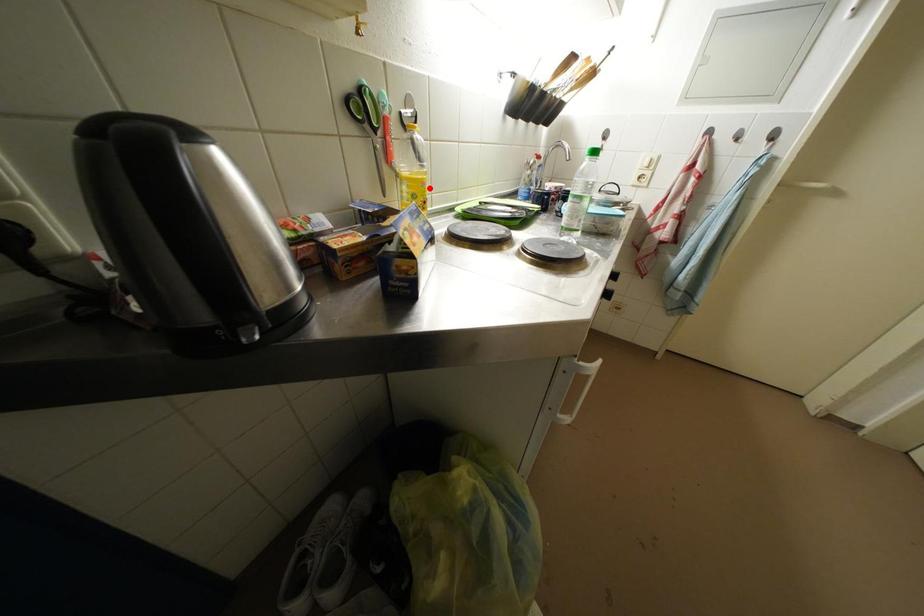
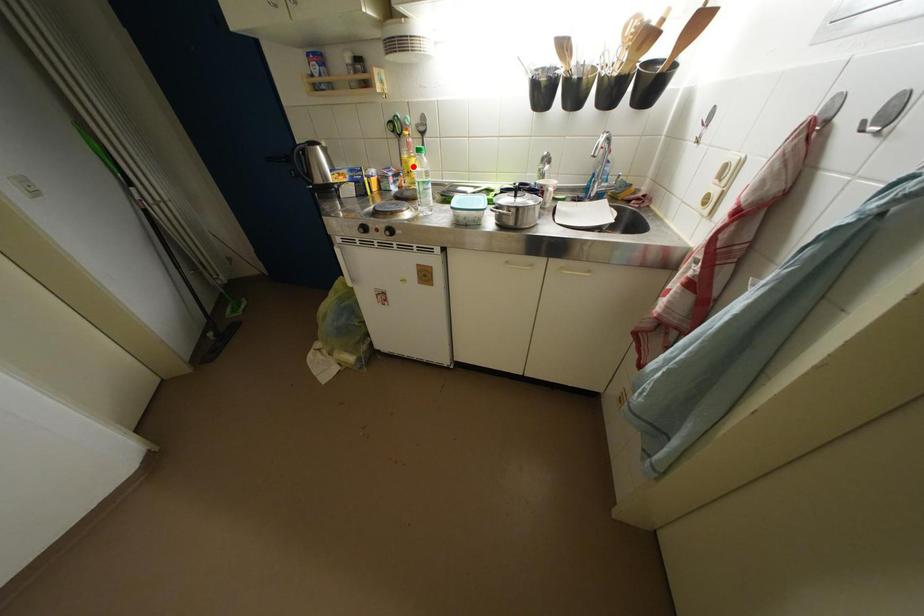
I am providing you with two images of the same scene from different viewpoints. A red point is marked on the first image and another point is marked on the second image. Is the marked point in image1 the same physical position as the marked point in image2?

Yes